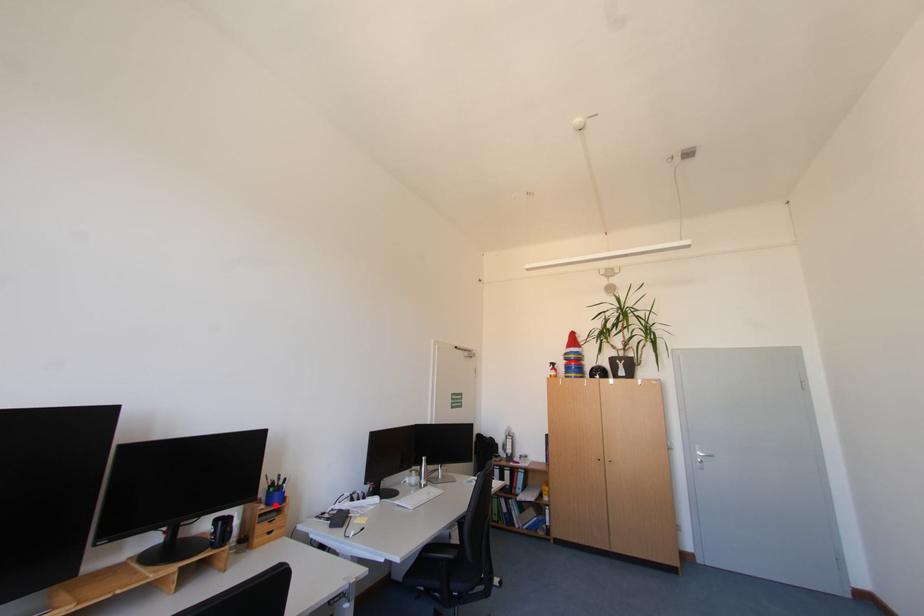
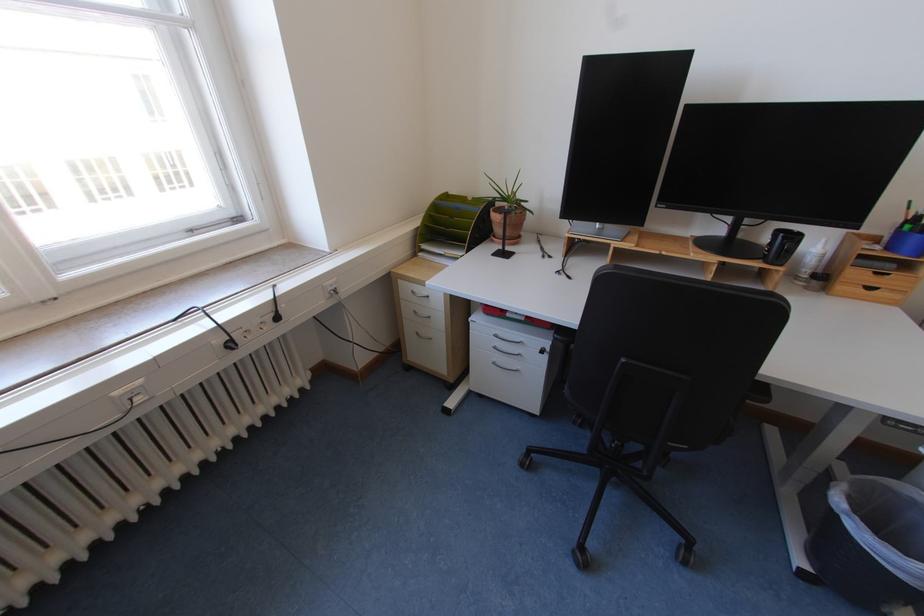
Where in the second image is the point corresponding to the highlighted location from the first image?

(896, 249)